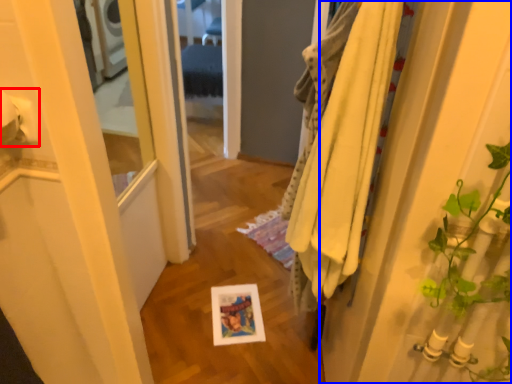
Question: Which point is closer to the camera, toilet paper (highlighted by a red box) or door (highlighted by a blue box)?

Choices:
 (A) toilet paper
 (B) door

Answer: (B)